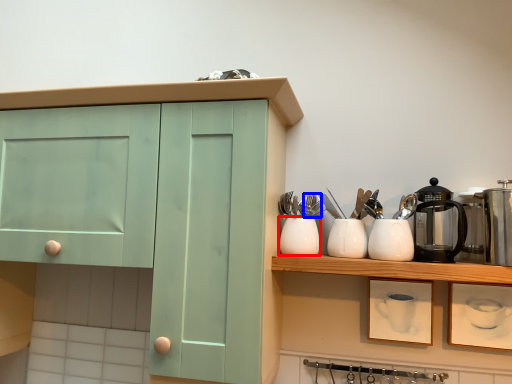
Question: Among these objects, which one is farthest to the camera, tableware (highlighted by a red box) or silverware (highlighted by a blue box)?

Choices:
 (A) tableware
 (B) silverware

Answer: (B)